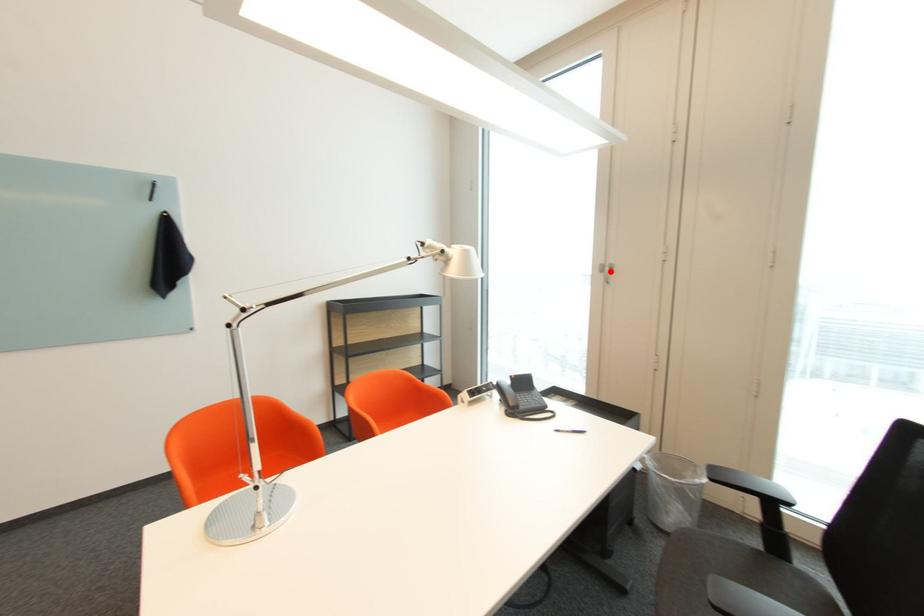
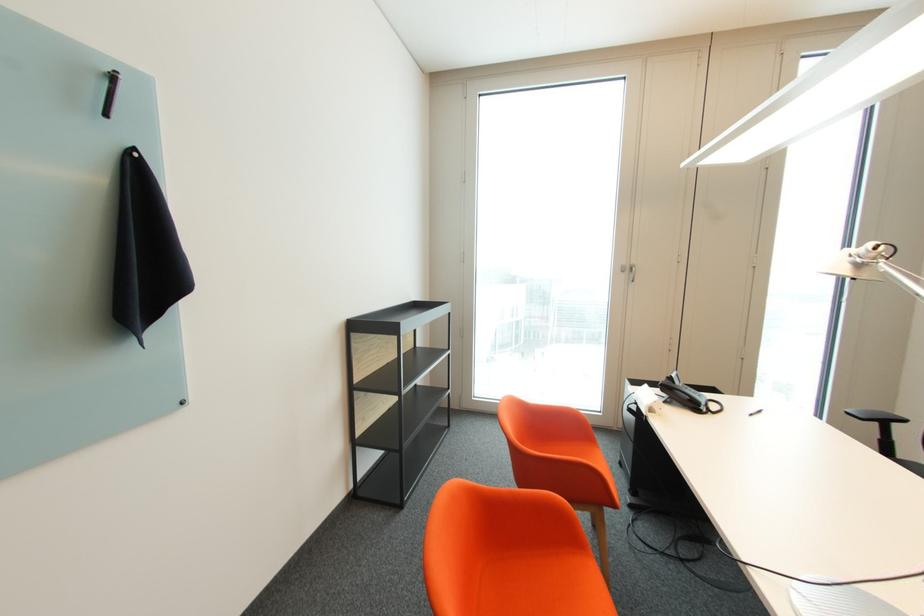
The point at the highlighted location is marked in the first image. Where is the corresponding point in the second image?

(629, 272)